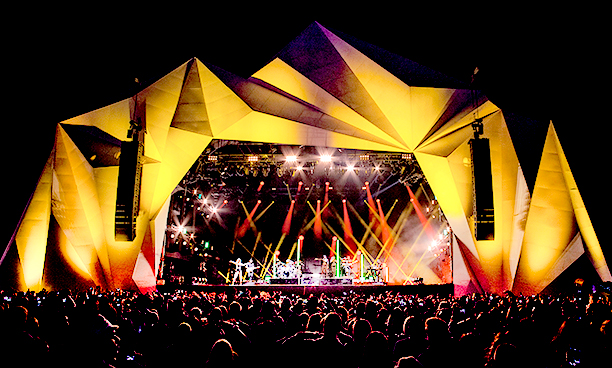
Locate an element on the screen. This screenshot has height=368, width=612. stage is located at coordinates (291, 284).